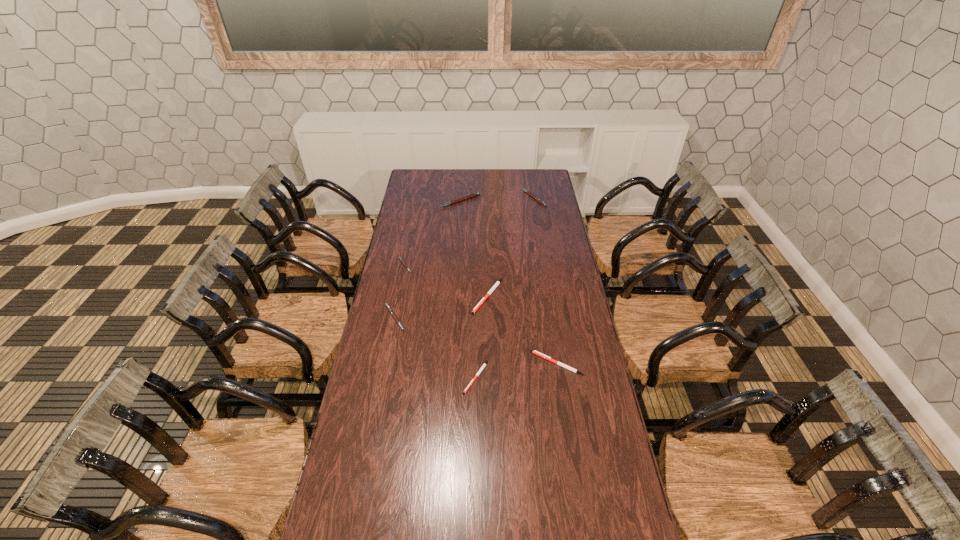
In order to click on the tallest pen in this screenshot , I will do `click(475, 194)`.

Identify the location of the tallest object. This screenshot has height=540, width=960. (475, 194).

Find the location of a particular element. the third smallest pink pen is located at coordinates (540, 201).

This screenshot has height=540, width=960. Find the location of `the farthest white pen`. the farthest white pen is located at coordinates (497, 283).

Find the location of a particular element. the second smallest pink pen is located at coordinates (389, 308).

In order to click on the rightmost white pen in this screenshot , I will do `click(533, 351)`.

Image resolution: width=960 pixels, height=540 pixels. I want to click on the smallest pink pen, so click(400, 258).

Image resolution: width=960 pixels, height=540 pixels. Identify the location of the fifth nearest pen. (400, 258).

At what (x,y) coordinates should I click in order to perform the action: click on the smallest white pen. Please return your answer as a coordinate pair (x, y). The image size is (960, 540). Looking at the image, I should click on (485, 363).

Identify the location of free space located at the nib of the third pink pen from left to right. (459, 235).